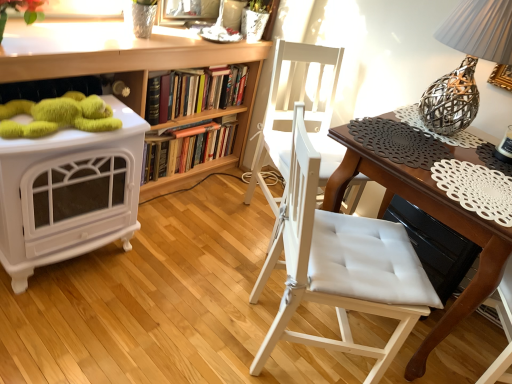
Question: From a real-world perspective, is hardcover books at center, arranged as the first book when viewed from the top, positioned above or below woven metallic lampshade at upper right?

Choices:
 (A) above
 (B) below

Answer: (B)

Question: From the image's perspective, is hardcover books at center, the 2th book ordered from the bottom, located above or below woven metallic lampshade at upper right?

Choices:
 (A) below
 (B) above

Answer: (B)

Question: Which object is the closest to the green fuzzy toy at upper left?

Choices:
 (A) white padded chair at center, positioned as the second chair in back-to-front order
 (B) wooden table at center
 (C) wooden bookcase at upper center
 (D) white padded chair at center, the 2th chair positioned from the front
 (E) hardcover book at center, which is counted as the second book, starting from the top

Answer: (C)

Question: Which object is positioned farthest from the hardcover books at center, the 2th book ordered from the bottom?

Choices:
 (A) hardcover book at center, which is counted as the second book, starting from the top
 (B) white glossy fireplace at left
 (C) white padded chair at center, acting as the 1th chair starting from the back
 (D) wooden bookcase at upper center
 (E) white padded chair at center, positioned as the 1th chair in front-to-back order

Answer: (E)